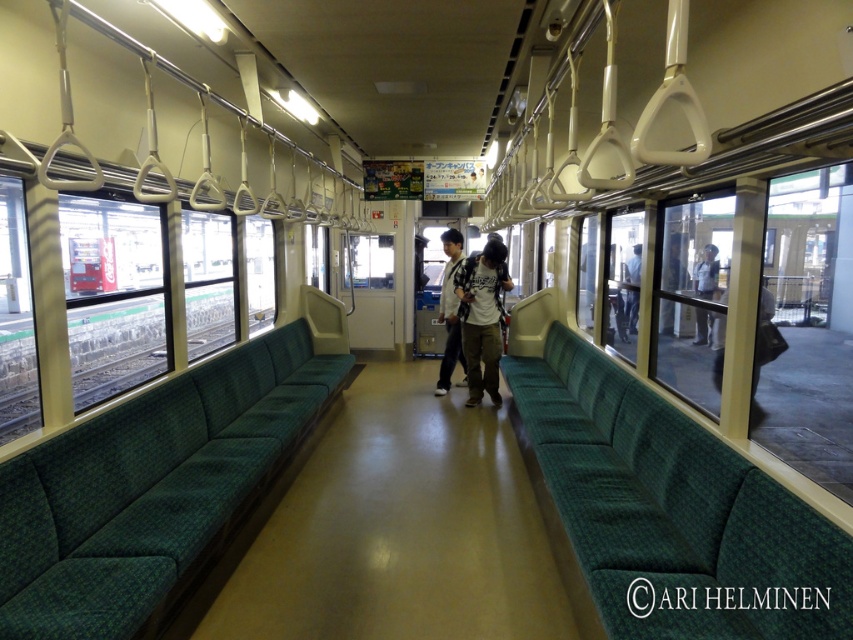
You are a passenger on the train and want to know if you can place your light gray uniform at center on the green fabric couch at center without it falling off. Can you do that?

The green fabric couch at center is bigger than the light gray uniform at center, so yes, you can place the light gray uniform at center on the green fabric couch at center without it falling off.